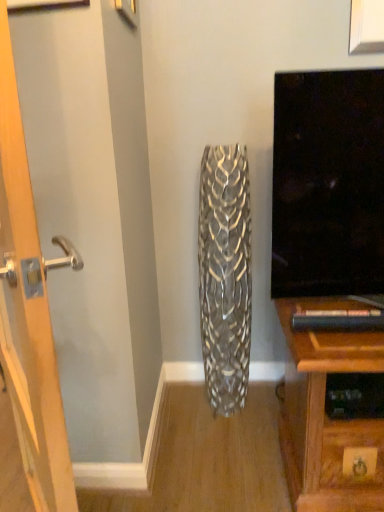
Where is `vacant space in front of silver metallic vase at center`? This screenshot has height=512, width=384. vacant space in front of silver metallic vase at center is located at coordinates (229, 437).